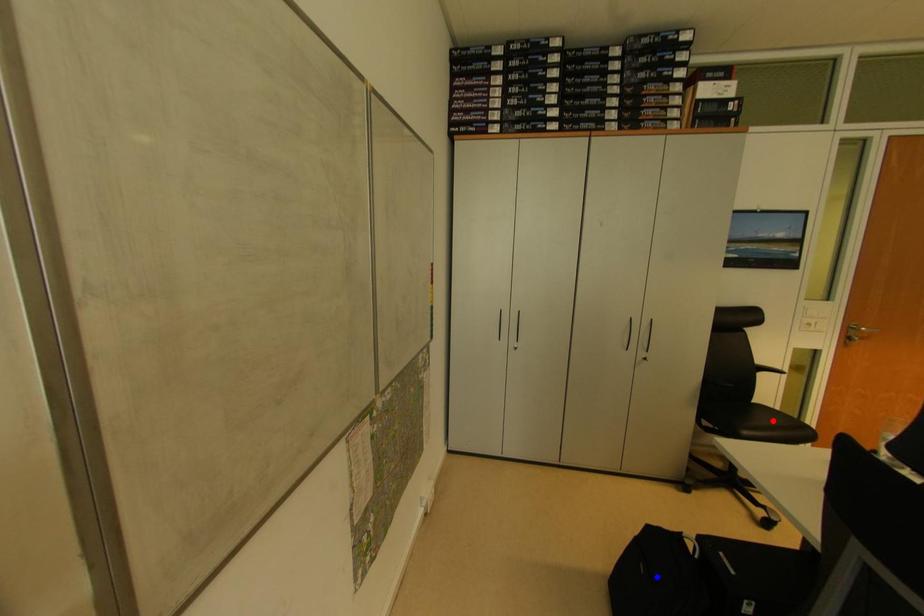
Question: Two points are marked on the image. Which point is closer to the camera?

Choices:
 (A) Blue point is closer.
 (B) Red point is closer.

Answer: (A)